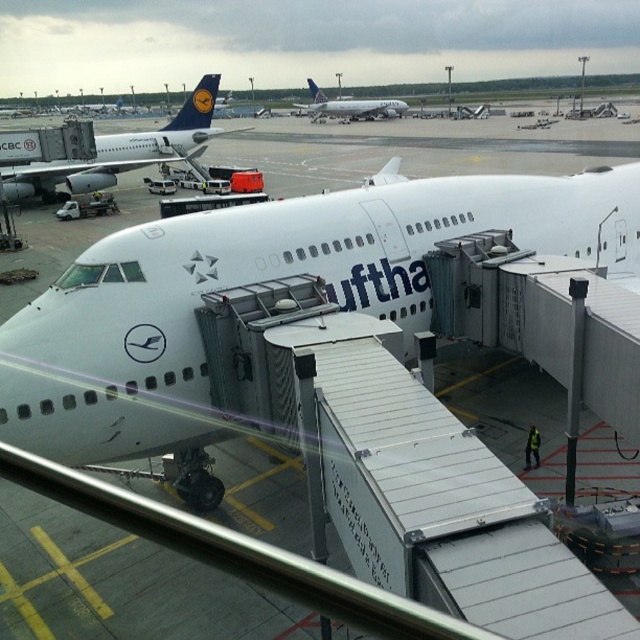
Can you confirm if white matte airplane at center is taller than white glossy airplane at upper left?

Incorrect, white matte airplane at center's height is not larger of white glossy airplane at upper left's.

Is white matte airplane at center to the left of white glossy airplane at upper left from the viewer's perspective?

Incorrect, white matte airplane at center is not on the left side of white glossy airplane at upper left.

The image size is (640, 640). Find the location of `white matte airplane at center`. white matte airplane at center is located at coordinates (x=260, y=280).

I want to click on white matte airplane at center, so click(260, 280).

Looking at this image, between white matte airplane at center and white glossy airplane at center, which one has more height?

white glossy airplane at center is taller.

Can you confirm if white matte airplane at center is positioned below white glossy airplane at center?

Indeed, white matte airplane at center is positioned under white glossy airplane at center.

Is point (132, 384) positioned behind point (394, 100)?

No, it is in front of (394, 100).

In order to click on white matte airplane at center in this screenshot , I will do `click(260, 280)`.

Based on the photo, who is shorter, white glossy airplane at upper left or white glossy airplane at center?

white glossy airplane at center

Is white glossy airplane at upper left bigger than white glossy airplane at center?

Indeed, white glossy airplane at upper left has a larger size compared to white glossy airplane at center.

Between point (122, 147) and point (301, 108), which one is positioned behind?

The point (301, 108) is more distant.

I want to click on white glossy airplane at upper left, so click(122, 150).